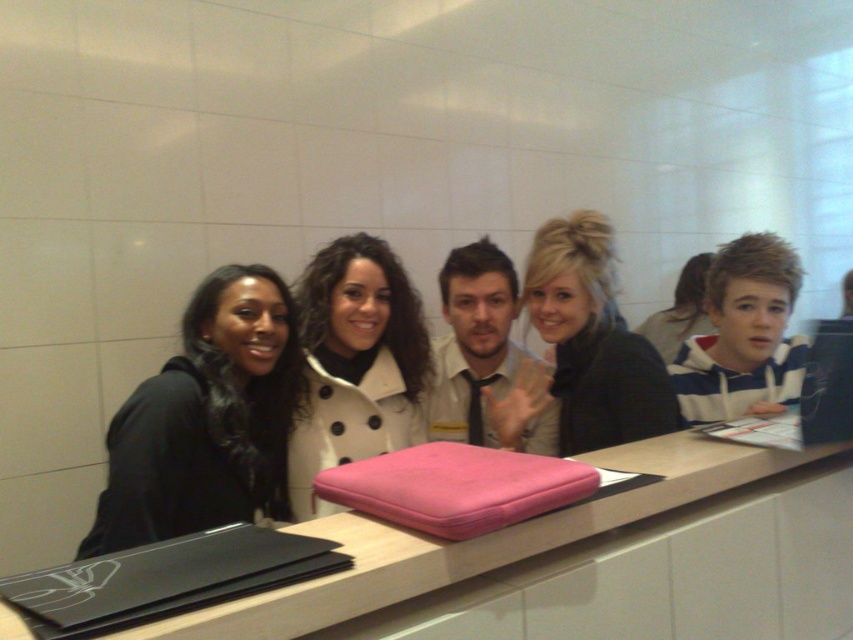
Is black matte jacket at left thinner than white polka dot coat at center?

No.

Between point (223, 454) and point (345, 460), which one is positioned in front?

Point (223, 454)

Who is more distant from viewer, (210,452) or (375,316)?

Point (375,316)

The width and height of the screenshot is (853, 640). Identify the location of black matte jacket at left. (206, 422).

Is pink fabric at center above white plastic laptop at right?

No.

Which of these two, pink fabric at center or white plastic laptop at right, stands shorter?

pink fabric at center

Is point (778, 458) in front of point (805, 372)?

Yes, point (778, 458) is closer to viewer.

At what (x,y) coordinates should I click in order to perform the action: click on pink fabric at center. Please return your answer as a coordinate pair (x, y). Looking at the image, I should click on (477, 540).

Which is in front, point (206, 525) or point (666, 376)?

Positioned in front is point (206, 525).

How far apart are black matte jacket at left and matte black jacket at center?

The distance of black matte jacket at left from matte black jacket at center is 21.70 inches.

Does point (189, 387) come closer to viewer compared to point (618, 337)?

Yes, point (189, 387) is in front of point (618, 337).

The image size is (853, 640). What are the coordinates of `black matte jacket at left` in the screenshot? It's located at (206, 422).